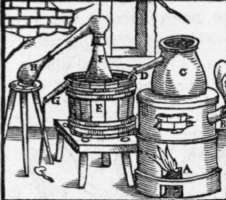
Locate an element on the screen. window frame is located at coordinates (144, 35).